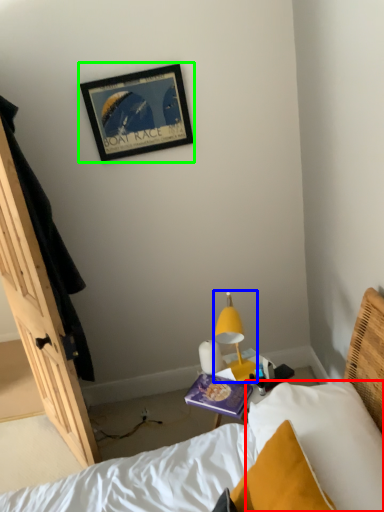
Question: Which object is the closest to the pillow (highlighted by a red box)? Choose among these: lamp (highlighted by a blue box) or picture frame (highlighted by a green box).

Choices:
 (A) lamp
 (B) picture frame

Answer: (A)